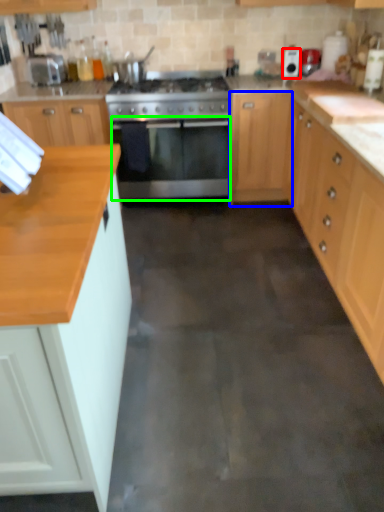
Question: Estimate the real-world distances between objects in this image. Which object is farther from appliance (highlighted by a red box), cabinetry (highlighted by a blue box) or oven (highlighted by a green box)?

Choices:
 (A) cabinetry
 (B) oven

Answer: (B)